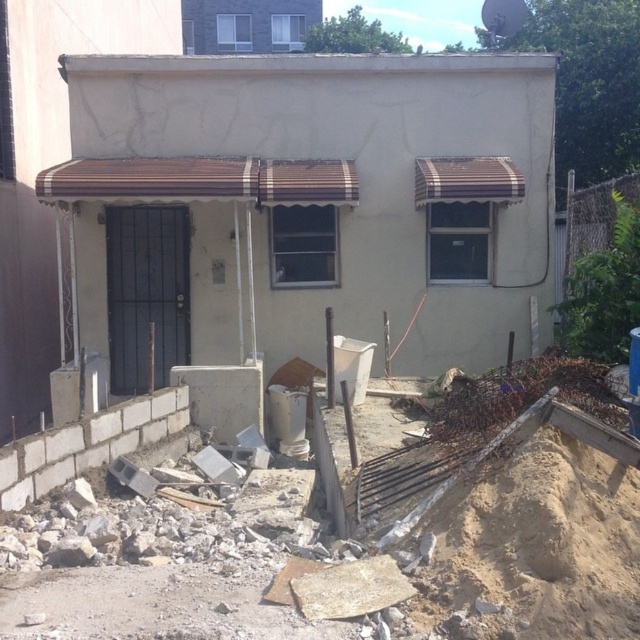
Can you confirm if beige stucco house at center is positioned above white block wall at lower left?

Yes.

Between beige stucco house at center and white block wall at lower left, which one is positioned lower?

Positioned lower is white block wall at lower left.

Is point (97, 209) closer to camera compared to point (106, 413)?

No, (97, 209) is further to viewer.

Where is `beige stucco house at center`? This screenshot has width=640, height=640. beige stucco house at center is located at coordinates (307, 205).